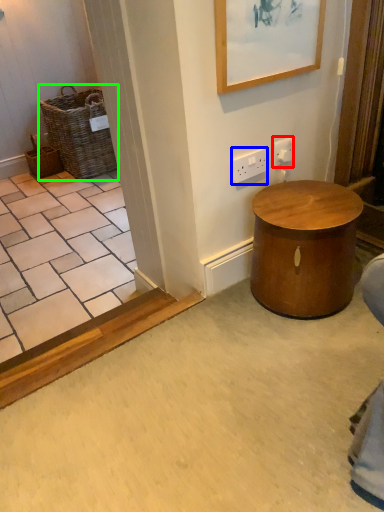
Question: Which object is positioned farthest from electric outlet (highlighted by a red box)? Select from electric outlet (highlighted by a blue box) and basket (highlighted by a green box).

Choices:
 (A) electric outlet
 (B) basket

Answer: (B)